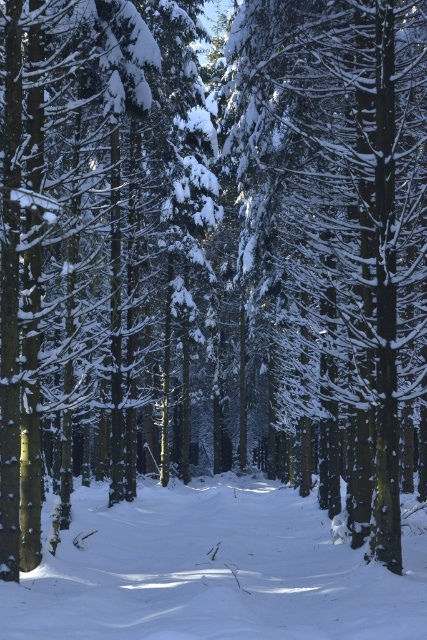
Question: Which point is farther to the camera?

Choices:
 (A) (195, 564)
 (B) (362, 42)

Answer: (A)

Question: Does snow-covered tree at center have a lesser width compared to white powdery snow at center?

Choices:
 (A) yes
 (B) no

Answer: (A)

Question: Which object appears closest to the camera in this image?

Choices:
 (A) white powdery snow at center
 (B) snow-covered tree at center

Answer: (A)

Question: Is snow-covered tree at center smaller than white powdery snow at center?

Choices:
 (A) no
 (B) yes

Answer: (A)

Question: Can you confirm if snow-covered tree at center is positioned to the right of white powdery snow at center?

Choices:
 (A) yes
 (B) no

Answer: (A)